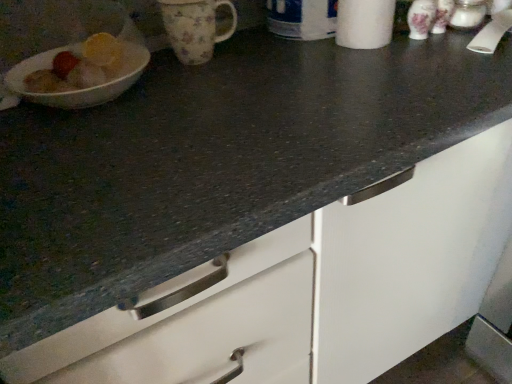
Question: Can you confirm if floral ceramic mug at upper center is positioned to the right of white paper towel at upper right?

Choices:
 (A) yes
 (B) no

Answer: (B)

Question: From the image's perspective, does floral ceramic mug at upper center appear higher than white paper towel at upper right?

Choices:
 (A) no
 (B) yes

Answer: (A)

Question: Is floral ceramic mug at upper center surrounding white paper towel at upper right?

Choices:
 (A) yes
 (B) no

Answer: (B)

Question: Is floral ceramic mug at upper center at the left side of white paper towel at upper right?

Choices:
 (A) yes
 (B) no

Answer: (A)

Question: From a real-world perspective, is floral ceramic mug at upper center on white paper towel at upper right?

Choices:
 (A) no
 (B) yes

Answer: (A)

Question: Is floral ceramic mug at upper center completely or partially outside of white paper towel at upper right?

Choices:
 (A) no
 (B) yes

Answer: (B)

Question: Does white paper towel at upper right come in front of floral ceramic mug at upper center?

Choices:
 (A) no
 (B) yes

Answer: (B)

Question: From a real-world perspective, does white paper towel at upper right sit lower than floral ceramic mug at upper center?

Choices:
 (A) yes
 (B) no

Answer: (B)

Question: Can you confirm if white paper towel at upper right is thinner than floral ceramic mug at upper center?

Choices:
 (A) yes
 (B) no

Answer: (A)

Question: Is white paper towel at upper right facing away from floral ceramic mug at upper center?

Choices:
 (A) yes
 (B) no

Answer: (B)

Question: Is white paper towel at upper right completely or partially outside of floral ceramic mug at upper center?

Choices:
 (A) no
 (B) yes

Answer: (B)

Question: Is white paper towel at upper right bigger than floral ceramic mug at upper center?

Choices:
 (A) no
 (B) yes

Answer: (B)

Question: Considering their positions, is white paper towel at upper right located in front of or behind floral ceramic mug at upper center?

Choices:
 (A) behind
 (B) front

Answer: (B)